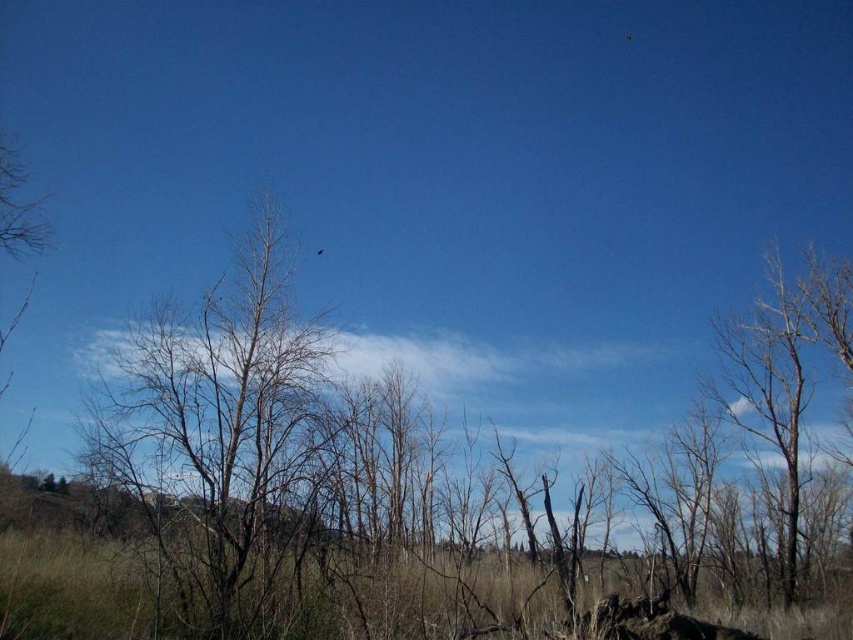
Does brown bare tree at center have a lesser width compared to bare wood tree at right?

No, brown bare tree at center is not thinner than bare wood tree at right.

This screenshot has height=640, width=853. What do you see at coordinates (225, 436) in the screenshot? I see `brown bare tree at center` at bounding box center [225, 436].

Between point (144, 394) and point (790, 529), which one is positioned behind?

The point (790, 529) is more distant.

Locate an element on the screen. brown bare tree at center is located at coordinates 225,436.

Between bare wood tree at right and black glossy bird at upper center, which one has less height?

With less height is black glossy bird at upper center.

Consider the image. Does bare wood tree at right have a greater width compared to black glossy bird at upper center?

Yes.

Does point (827, 308) come in front of point (320, 250)?

Yes, point (827, 308) is in front of point (320, 250).

Locate an element on the screen. The width and height of the screenshot is (853, 640). bare wood tree at right is located at coordinates (784, 372).

How far apart are brown bare tree at center and black glossy bird at upper center?

The distance of brown bare tree at center from black glossy bird at upper center is 21.44 meters.

Is brown bare tree at center below black glossy bird at upper center?

Yes, brown bare tree at center is below black glossy bird at upper center.

The width and height of the screenshot is (853, 640). What do you see at coordinates (225, 436) in the screenshot?
I see `brown bare tree at center` at bounding box center [225, 436].

This screenshot has width=853, height=640. In order to click on brown bare tree at center in this screenshot , I will do `click(225, 436)`.